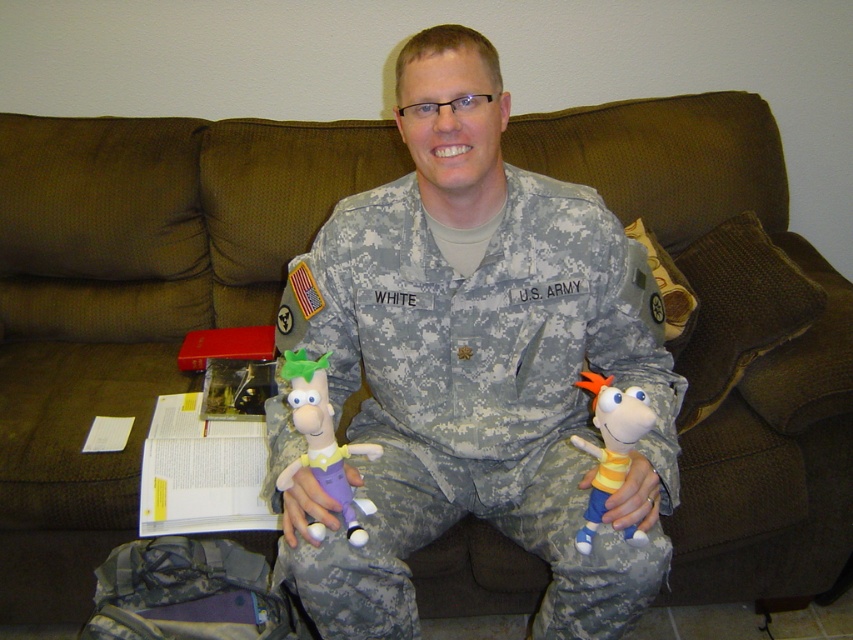
You are a photographer taking a picture of the man on the couch. You want to focus on the point at coordinates point (325, 419) and point (625, 532). Which point should you focus on first to ensure both are in focus?

Point (325, 419) is in front of point (625, 532), so you should focus on point (325, 419) first to ensure both are in focus.

You are a photographer taking a picture of the man on the couch. You need to position two lights at the coordinates provided. The first light is at point (438, 378) and the second at point (624, 474). According to the scene description, which light is closer to the camera?

Point (624, 474) is closer to the camera because the description states that point (438, 378) is behind point (624, 474).

You are a photographer taking a picture of the camouflage fabric us army uniform at center and the yellow striped fabric doll at lower right. Which object should you focus on first to ensure it appears sharp in the photo?

You should focus on the camouflage fabric us army uniform at center first because it is closer to the viewer than the yellow striped fabric doll at lower right.